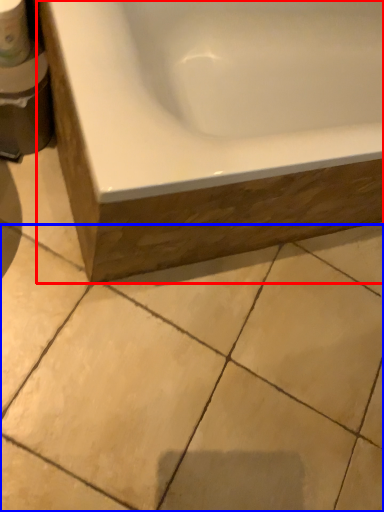
Question: Which object is closer to the camera taking this photo, bathtub (highlighted by a red box) or ceramic tile (highlighted by a blue box)?

Choices:
 (A) bathtub
 (B) ceramic tile

Answer: (A)